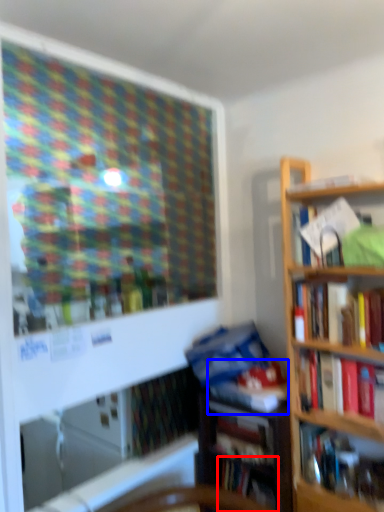
Question: Which object is closer to the camera taking this photo, book (highlighted by a red box) or book (highlighted by a blue box)?

Choices:
 (A) book
 (B) book

Answer: (B)